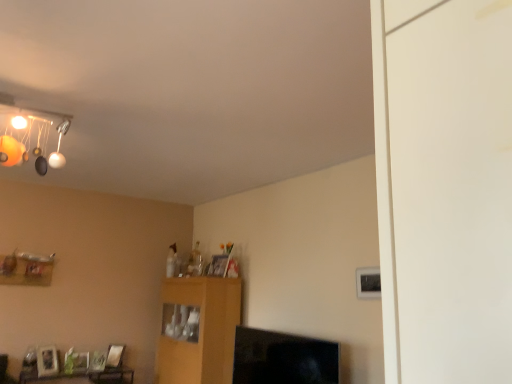
Question: In terms of height, does wooden table at lower left look taller or shorter compared to wooden shelf at lower left?

Choices:
 (A) short
 (B) tall

Answer: (A)

Question: Looking at the image, does wooden table at lower left seem bigger or smaller compared to wooden shelf at lower left?

Choices:
 (A) small
 (B) big

Answer: (B)

Question: Which object is positioned closest to the wooden shelf at lower left?

Choices:
 (A) wooden cabinet at center
 (B) wooden table at lower left

Answer: (B)

Question: Which of these objects is positioned closest to the wooden cabinet at center?

Choices:
 (A) wooden shelf at lower left
 (B) wooden table at lower left

Answer: (B)